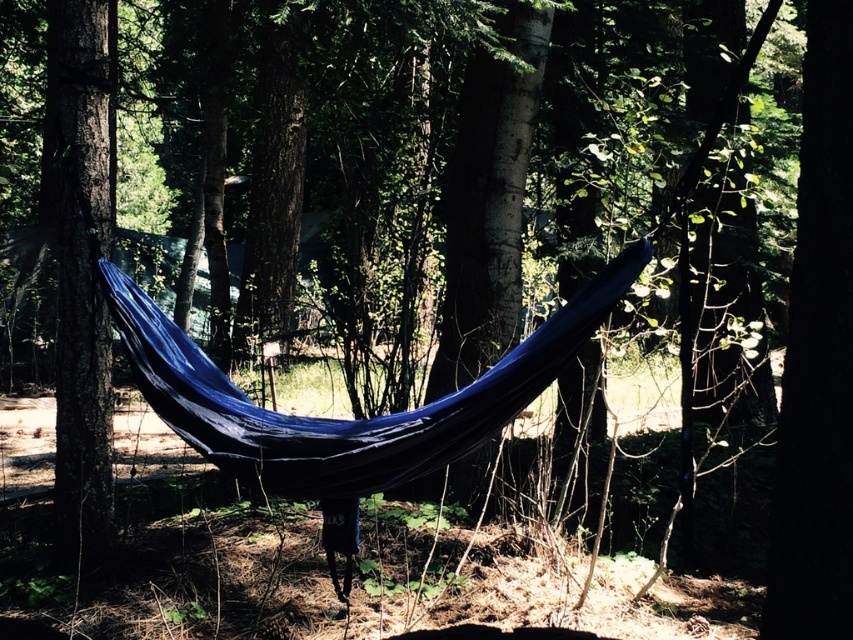
You are planning to hang a new hammock in your backyard. You have a piece of dark brown wood at center and a blue fabric hammock at center. Which object is smaller in size?

The dark brown wood at center has a smaller size compared to the blue fabric hammock at center, so the dark brown wood at center is smaller.

You are planning to hang a bird feeder between the blue fabric hammock at center and the dark brown wood tree at left. Based on their positions, which object is closer to the left side of the image?

The dark brown wood tree at left is closer to the left side of the image because the blue fabric hammock at center is to the right of it.